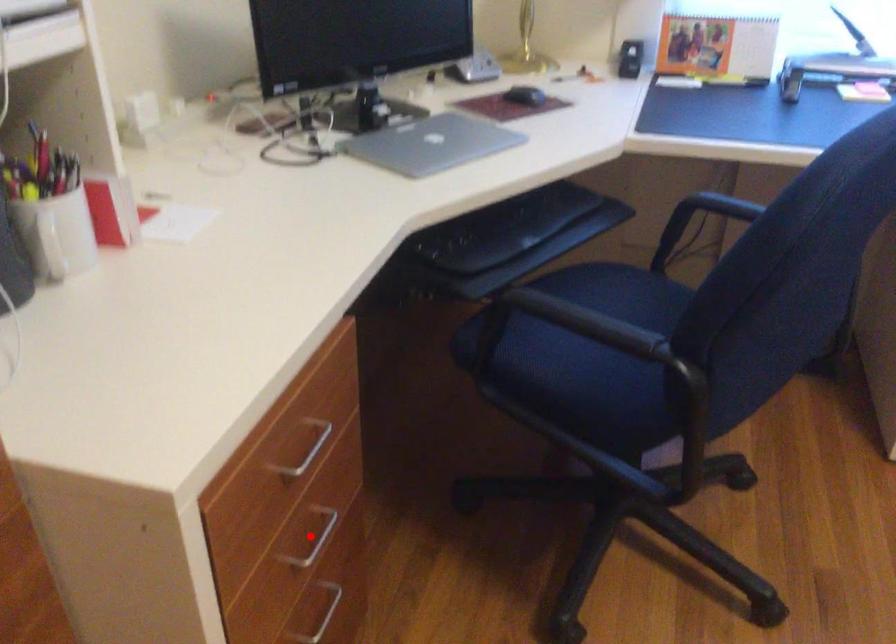
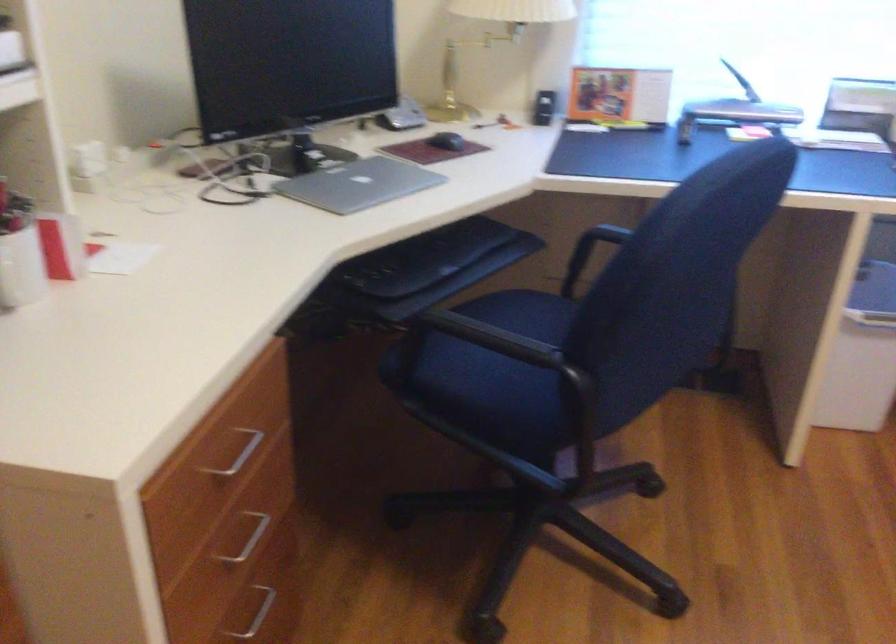
Question: I am providing you with two images of the same scene from different viewpoints. Image1 has a red point marked. In image2, the corresponding 3D location appears at what relative position? Reply with the corresponding letter.

Choices:
 (A) Closer
 (B) Farther

Answer: (B)